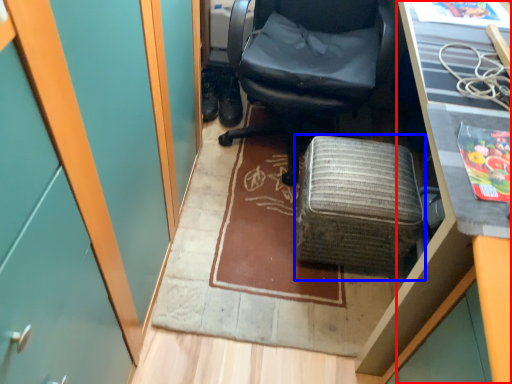
Question: Which point is further to the camera, desk (highlighted by a red box) or furniture (highlighted by a blue box)?

Choices:
 (A) desk
 (B) furniture

Answer: (B)